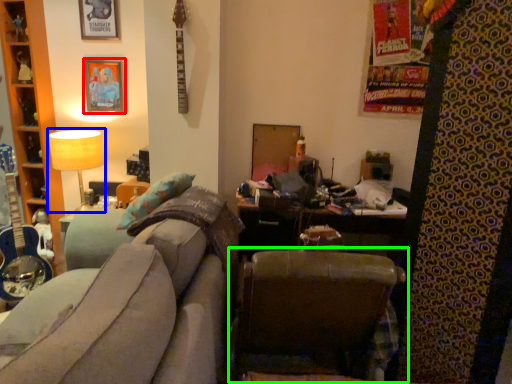
Question: Which object is the closest to the picture frame (highlighted by a red box)? Choose among these: table lamp (highlighted by a blue box) or chair (highlighted by a green box).

Choices:
 (A) table lamp
 (B) chair

Answer: (A)